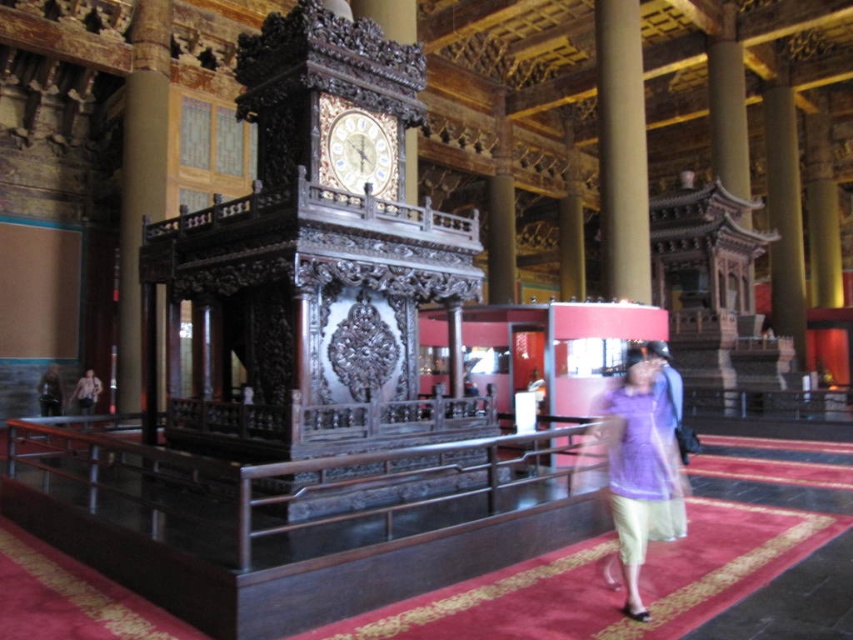
You are a security guard in the hall and need to ensure the purple fabric dress at center and the carved wood structure at upper right are both visible to visitors. Given their sizes, which object might require more strategic placement to ensure visibility?

The purple fabric dress at center is bigger than the carved wood structure at upper right, so it might require more strategic placement to ensure it doesn not block the view of the smaller carved wood structure at upper right.

You are standing in the ornate interior space of a historical building. You want to take a photo of the point at coordinates point (624,381). If your camera has a maximum focus range of 15 meters, will it be able to focus on the point?

The point (624,381) is 14.74 meters away from the camera. Since 14.74 meters is within the camera maximum focus range of 15 meters, the camera can focus on the point.

Based on the scene description, where is the smooth beige column at center located in terms of coordinates?

The smooth beige column at center is located at point coordinates of (622, 148).